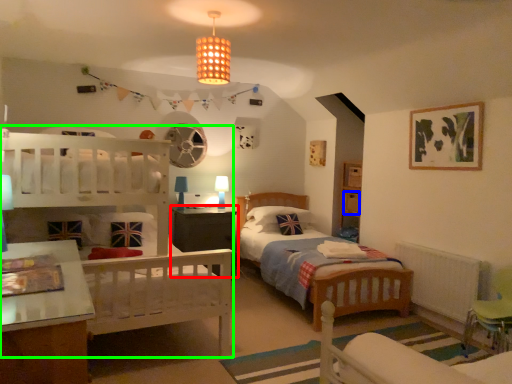
Question: Which object is the closest to the nightstand (highlighted by a red box)? Choose among these: drawer (highlighted by a blue box) or bunk bed (highlighted by a green box).

Choices:
 (A) drawer
 (B) bunk bed

Answer: (B)